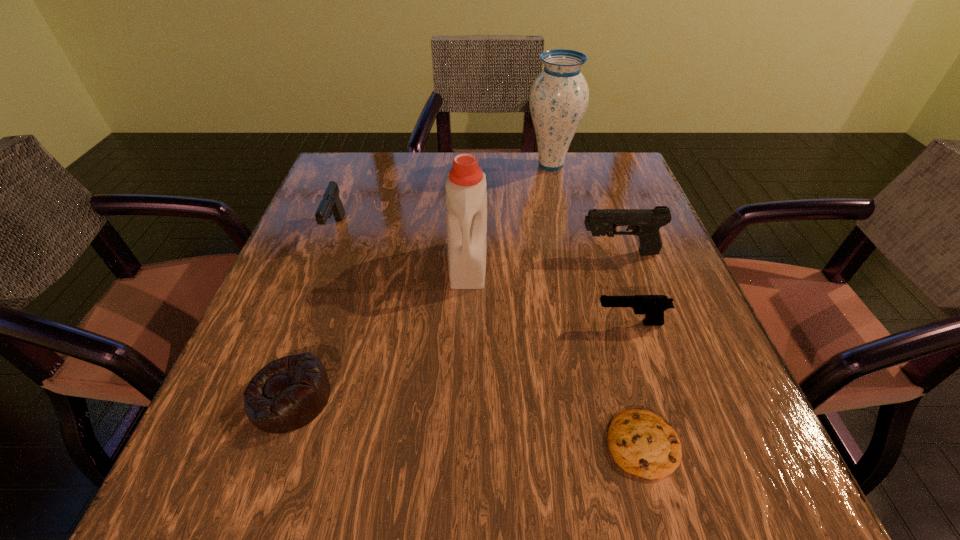
Find the location of a particular element. the farthest object is located at coordinates (558, 99).

Find the location of a particular element. the tallest object is located at coordinates (558, 99).

Find the location of a particular element. This screenshot has width=960, height=540. detergent is located at coordinates (466, 197).

Find the location of a particular element. The height and width of the screenshot is (540, 960). the third object from left to right is located at coordinates (466, 197).

Identify the location of the tallest pistol. The height and width of the screenshot is (540, 960). (645, 223).

Where is `the fifth shortest object`? Image resolution: width=960 pixels, height=540 pixels. the fifth shortest object is located at coordinates 645,223.

Locate an element on the screen. This screenshot has height=540, width=960. the farthest pistol is located at coordinates (331, 204).

The width and height of the screenshot is (960, 540). I want to click on the leftmost pistol, so click(331, 204).

You are a GUI agent. You are given a task and a screenshot of the screen. Output one action in this format:
    pyautogui.click(x=<x>, y=<y>)
    Task: Click on the third nearest object
    
    Given the screenshot: What is the action you would take?
    pyautogui.click(x=653, y=306)

Find the location of `the fifth tallest object`. the fifth tallest object is located at coordinates (653, 306).